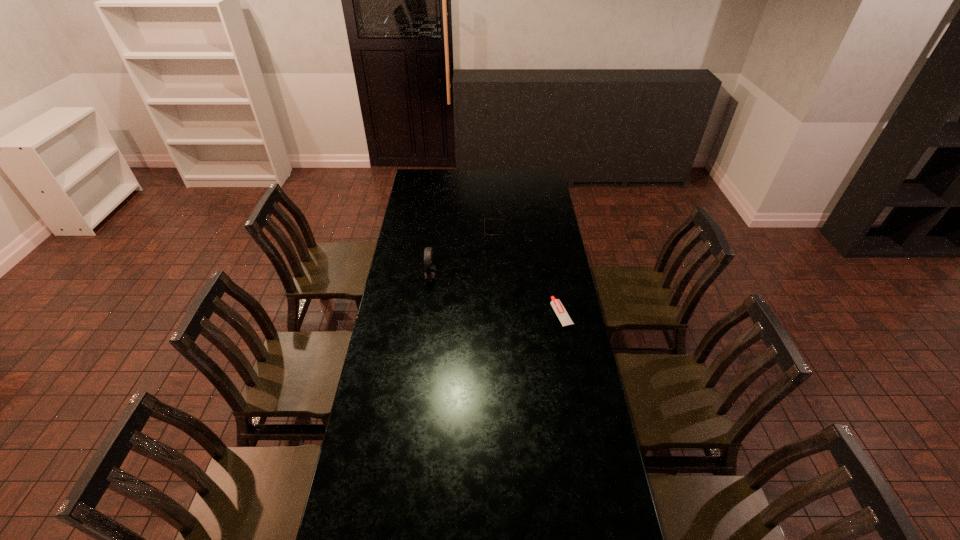
The width and height of the screenshot is (960, 540). Find the location of `vacant region located on the left of the nearest object`. vacant region located on the left of the nearest object is located at coordinates (505, 314).

You are a GUI agent. You are given a task and a screenshot of the screen. Output one action in this format:
    pyautogui.click(x=<x>, y=<y>)
    Task: Click on the object that is at the left edge
    
    Given the screenshot: What is the action you would take?
    tap(430, 271)

You are a GUI agent. You are given a task and a screenshot of the screen. Output one action in this format:
    pyautogui.click(x=<x>, y=<y>)
    Task: Click on the object that is positioned at the right edge
    This screenshot has width=960, height=540.
    Given the screenshot: What is the action you would take?
    pyautogui.click(x=556, y=304)

Identify the location of free space at the far edge of the desktop. (458, 172).

Where is `free region at the left edge of the desktop`? The image size is (960, 540). free region at the left edge of the desktop is located at coordinates (352, 474).

The height and width of the screenshot is (540, 960). I want to click on vacant space at the right edge of the desktop, so click(538, 231).

Identify the location of vacant space that's between the tallest object and the shortest object. This screenshot has width=960, height=540. (496, 296).

You are a GUI agent. You are given a task and a screenshot of the screen. Output one action in this format:
    pyautogui.click(x=<x>, y=<y>)
    Task: Click on the object that stands as the second closest to the nearest object
    The width and height of the screenshot is (960, 540).
    Given the screenshot: What is the action you would take?
    pyautogui.click(x=430, y=271)

Identify the location of object that can be found as the second closest to the farthest object. (556, 304).

Locate an element on the screen. free spot that satisfies the following two spatial constraints: 1. on the front-facing side of the headset; 2. on the left side of the shortest object is located at coordinates (426, 314).